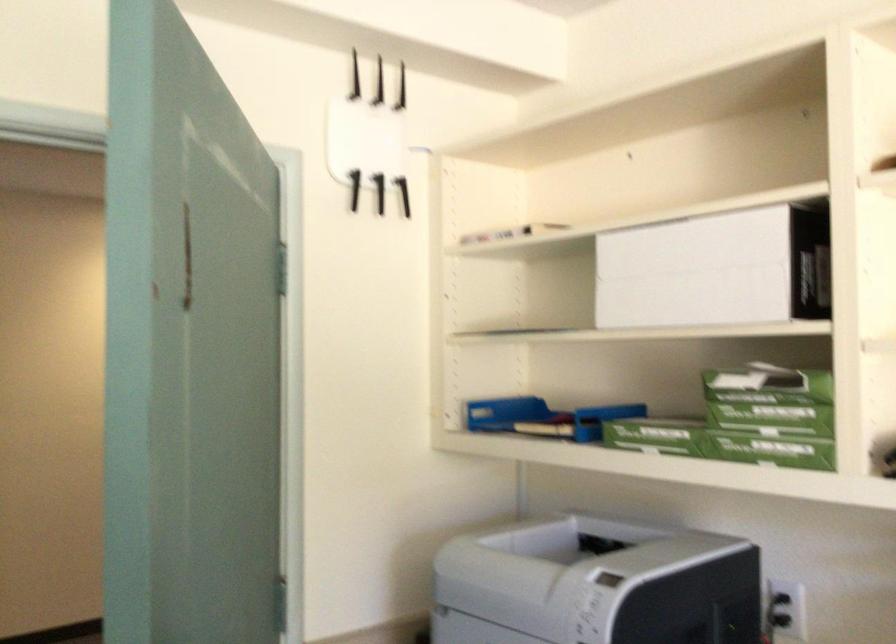
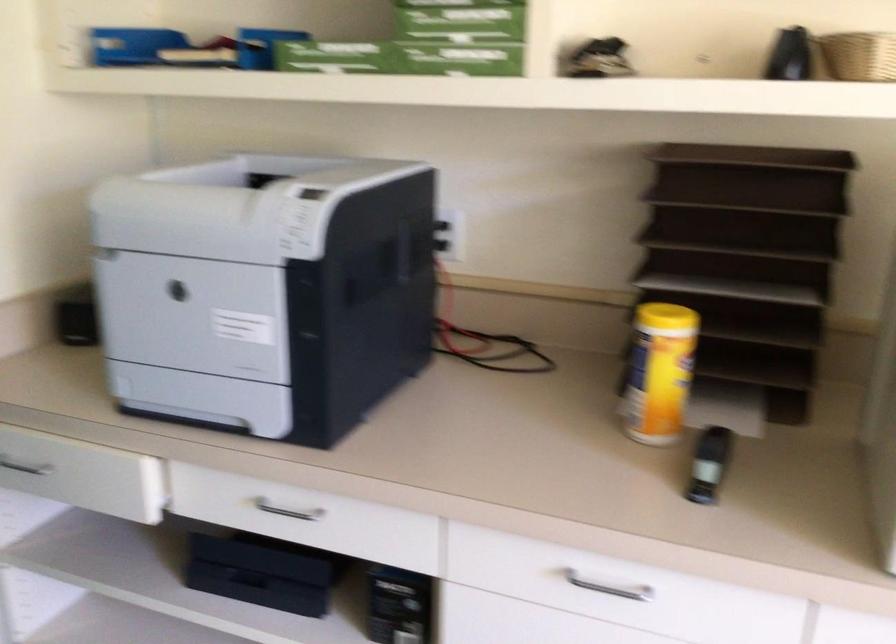
Find the pixel in the second image that matches [528,417] in the first image.

(165, 49)